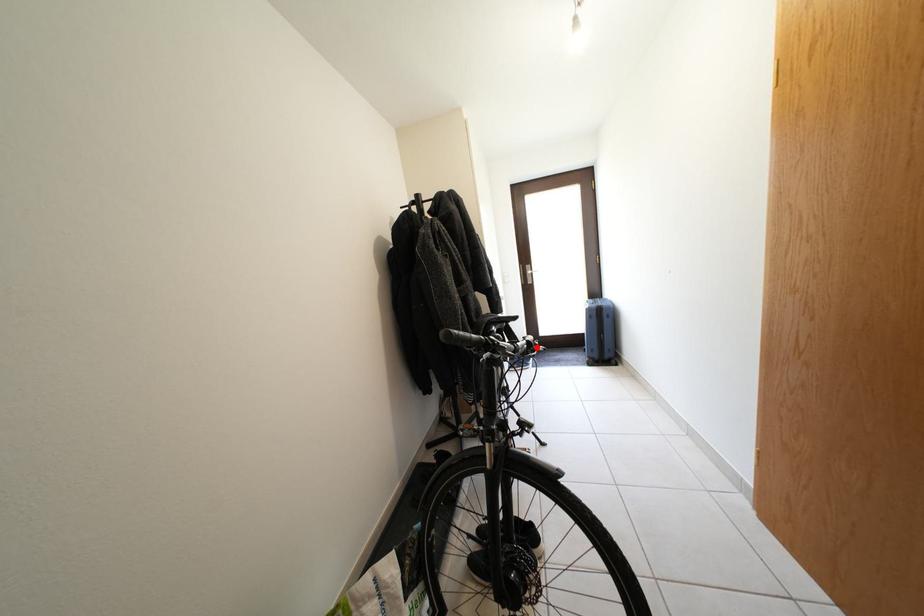
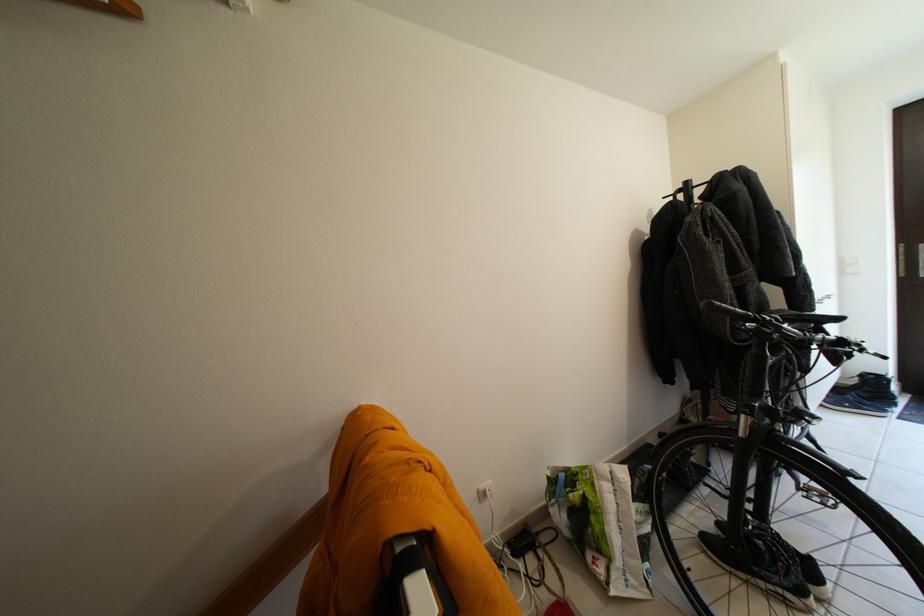
In the second image, find the point that corresponds to the highlighted location in the first image.

(849, 344)